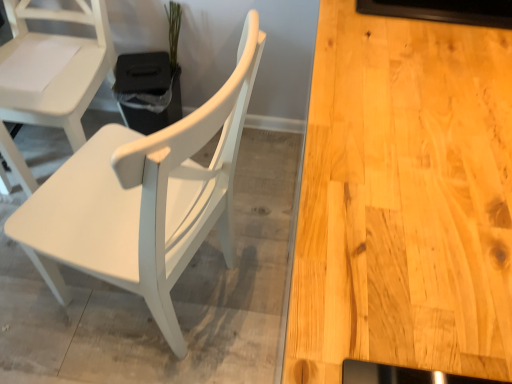
Question: Does white matte wood chair at left, positioned as the first chair in right-to-left order, appear on the right side of green matte plant at upper center?

Choices:
 (A) no
 (B) yes

Answer: (B)

Question: Does white matte wood chair at left, which is the second chair in left-to-right order, have a smaller size compared to green matte plant at upper center?

Choices:
 (A) yes
 (B) no

Answer: (B)

Question: From a real-world perspective, is white matte wood chair at left, which is the second chair in left-to-right order, positioned under green matte plant at upper center based on gravity?

Choices:
 (A) yes
 (B) no

Answer: (B)

Question: Is white matte wood chair at left, which is the second chair in left-to-right order, outside green matte plant at upper center?

Choices:
 (A) no
 (B) yes

Answer: (B)

Question: Does white matte wood chair at left, which is the second chair in left-to-right order, have a greater height compared to green matte plant at upper center?

Choices:
 (A) yes
 (B) no

Answer: (A)

Question: Is white matte wood chair at left, which is the second chair in left-to-right order, facing away from green matte plant at upper center?

Choices:
 (A) no
 (B) yes

Answer: (A)

Question: Can you confirm if white matte chair at left, acting as the second chair starting from the right, is thinner than green matte plant at upper center?

Choices:
 (A) no
 (B) yes

Answer: (A)

Question: Is white matte chair at left, acting as the second chair starting from the right, placed right next to green matte plant at upper center?

Choices:
 (A) no
 (B) yes

Answer: (A)

Question: Is white matte chair at left, acting as the second chair starting from the right, to the right of green matte plant at upper center from the viewer's perspective?

Choices:
 (A) no
 (B) yes

Answer: (A)

Question: Does white matte chair at left, acting as the second chair starting from the right, have a larger size compared to green matte plant at upper center?

Choices:
 (A) yes
 (B) no

Answer: (A)

Question: Is white matte chair at left, acting as the second chair starting from the right, completely or partially outside of green matte plant at upper center?

Choices:
 (A) yes
 (B) no

Answer: (A)

Question: From a real-world perspective, is white matte chair at left, the 1th chair in the left-to-right sequence, over green matte plant at upper center?

Choices:
 (A) no
 (B) yes

Answer: (A)

Question: Considering the relative sizes of white matte wood chair at left, which is the second chair in left-to-right order, and white matte chair at left, the 1th chair in the left-to-right sequence, in the image provided, is white matte wood chair at left, which is the second chair in left-to-right order, taller than white matte chair at left, the 1th chair in the left-to-right sequence,?

Choices:
 (A) no
 (B) yes

Answer: (B)